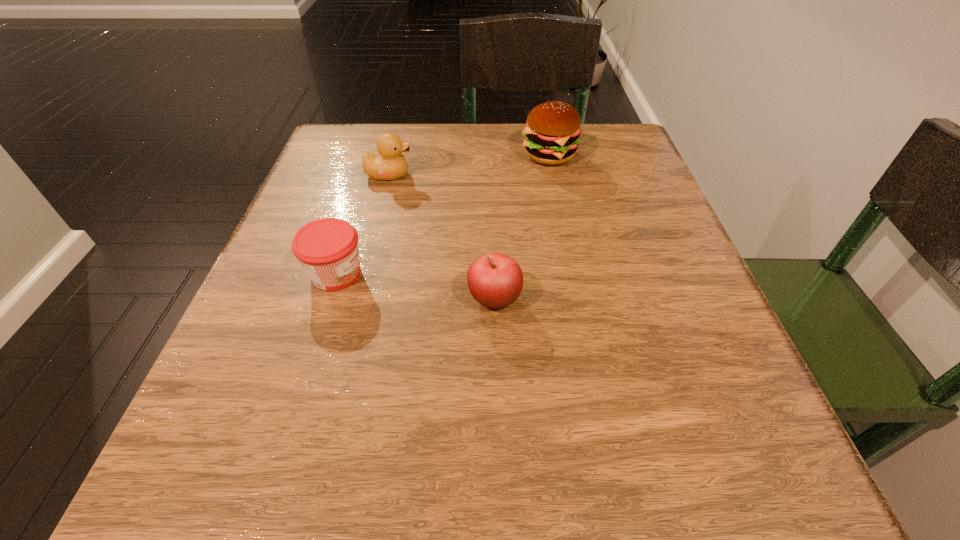
Locate an element on the screen. free spot between the jam and the apple is located at coordinates (415, 286).

Find the location of a particular element. Image resolution: width=960 pixels, height=540 pixels. free point between the apple and the jam is located at coordinates (415, 286).

Choose which object is the nearest neighbor to the duckling. Please provide its 2D coordinates. Your answer should be formatted as a tuple, i.e. [(x, y)], where the tuple contains the x and y coordinates of a point satisfying the conditions above.

[(327, 249)]

Identify the location of the third closest object relative to the tallest object. (327, 249).

The height and width of the screenshot is (540, 960). Find the location of `vacant space that satisfies the following two spatial constraints: 1. on the label side of the jam; 2. on the right side of the apple`. vacant space that satisfies the following two spatial constraints: 1. on the label side of the jam; 2. on the right side of the apple is located at coordinates (327, 299).